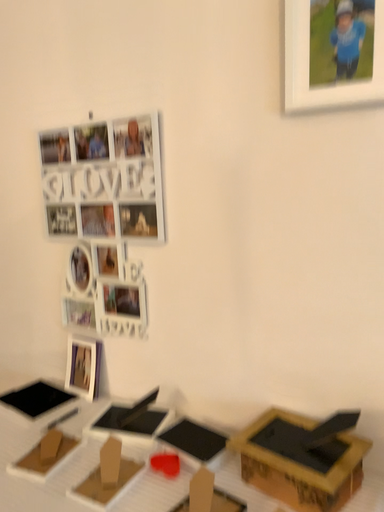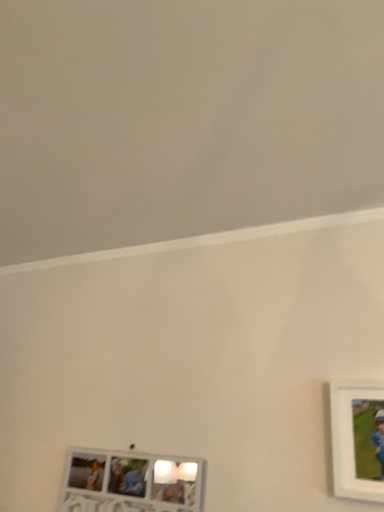
Question: Which way did the camera rotate in the video?

Choices:
 (A) rotated upward
 (B) rotated downward

Answer: (A)